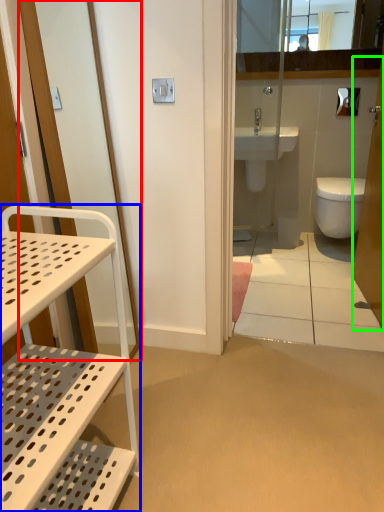
Question: Which object is the farthest from screen door (highlighted by a red box)? Choose among these: furniture (highlighted by a blue box) or screen door (highlighted by a green box).

Choices:
 (A) furniture
 (B) screen door

Answer: (B)